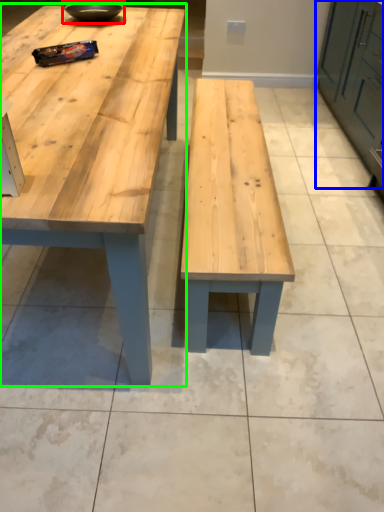
Question: Estimate the real-world distances between objects in this image. Which object is farther from bowl (highlighted by a red box), cabinetry (highlighted by a blue box) or table (highlighted by a green box)?

Choices:
 (A) cabinetry
 (B) table

Answer: (A)